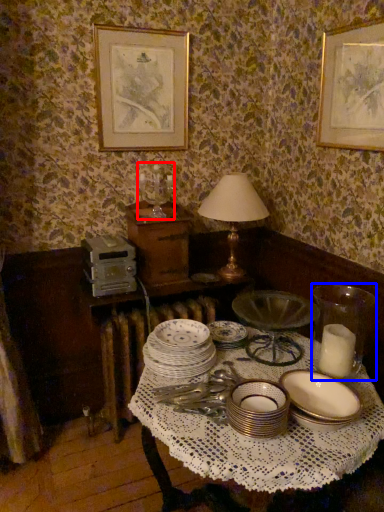
Question: Which object appears farthest to the camera in this image, candle holder (highlighted by a red box) or tableware (highlighted by a blue box)?

Choices:
 (A) candle holder
 (B) tableware

Answer: (A)